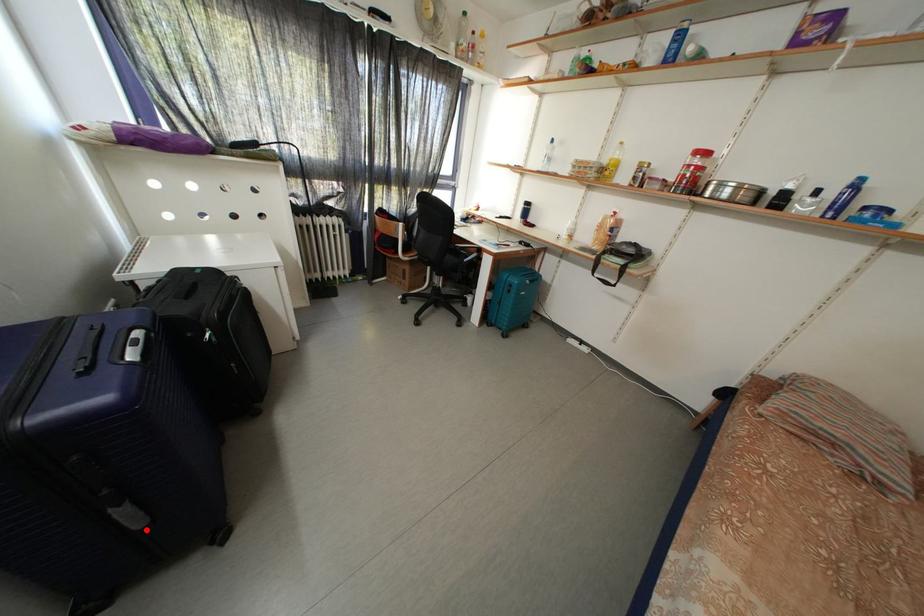
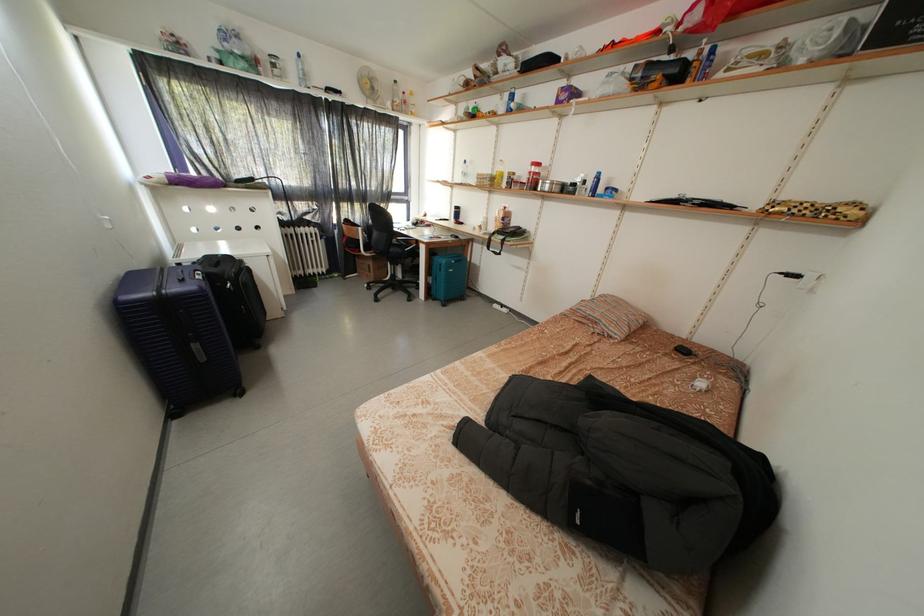
Locate, in the second image, the point that corresponds to the highlighted location in the first image.

(211, 363)